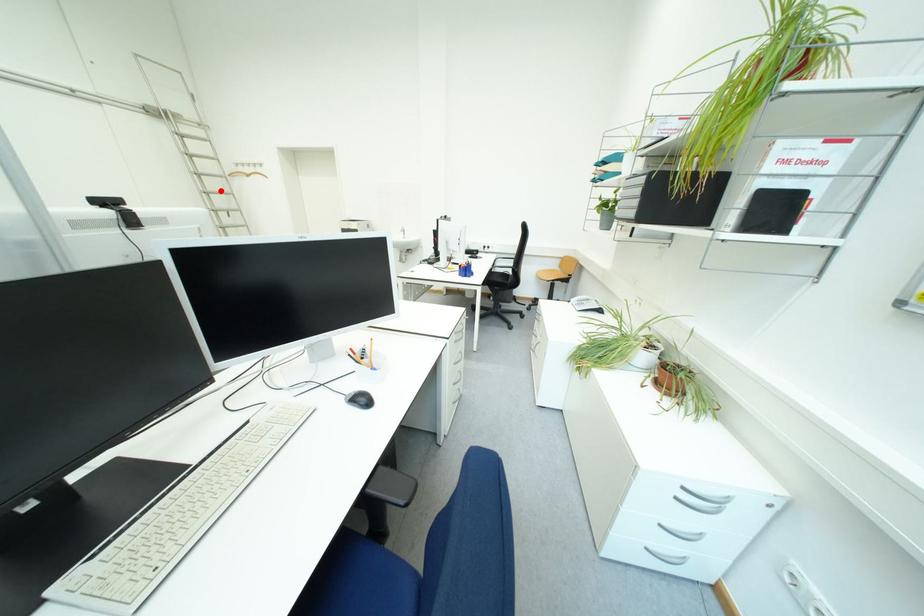
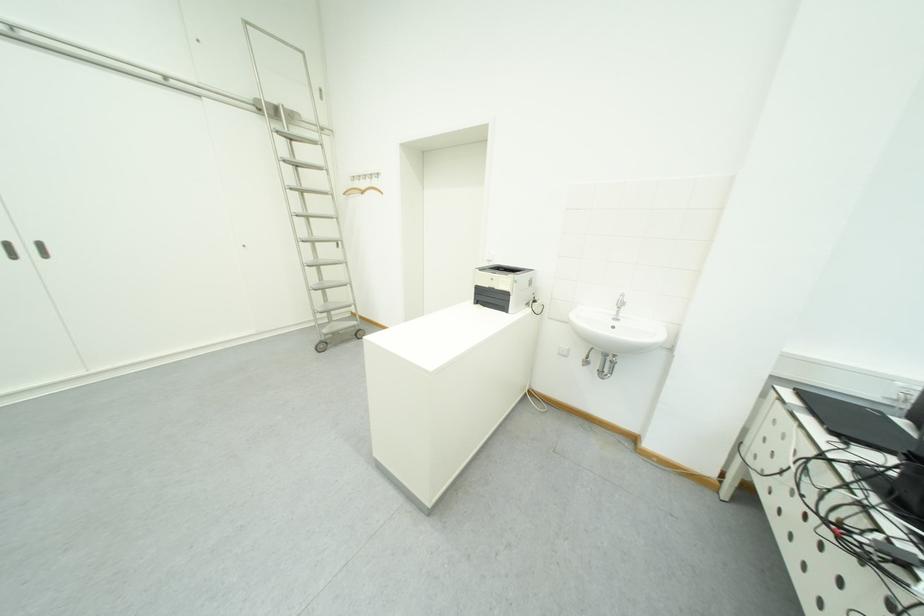
Question: I am providing you with two images of the same scene from different viewpoints. Given a red point in image1, look at the same physical point in image2. Is it:

Choices:
 (A) Closer to the viewpoint
 (B) Farther from the viewpoint

Answer: (A)